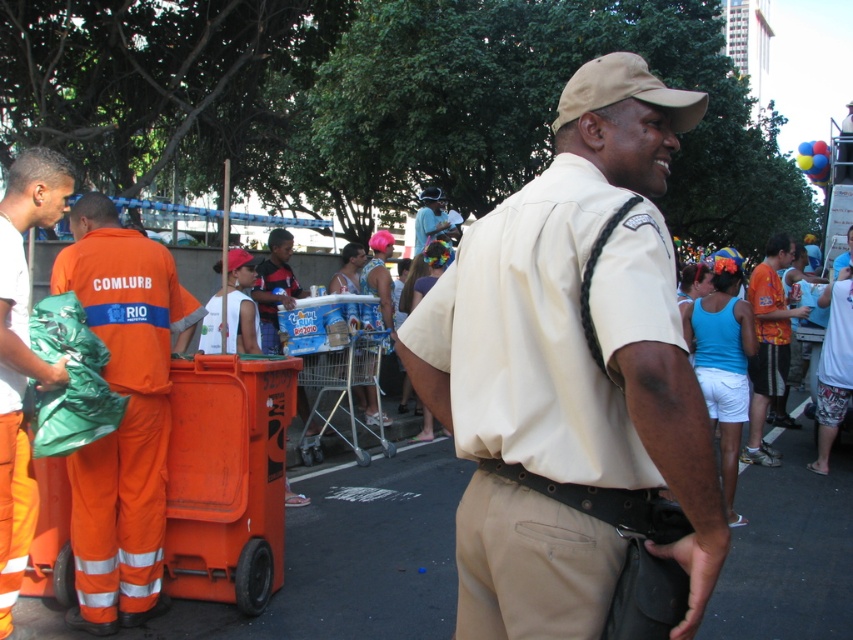
Question: Does beige uniform at center have a smaller size compared to white matte shirt at left?

Choices:
 (A) yes
 (B) no

Answer: (A)

Question: Which of the following is the farthest from the observer?

Choices:
 (A) orange jersey at center
 (B) matte blue helmet at center
 (C) orange reflective jumpsuit at left

Answer: (B)

Question: Does orange jersey at center have a smaller size compared to matte blue helmet at center?

Choices:
 (A) no
 (B) yes

Answer: (B)

Question: Which point is closer to the camera?

Choices:
 (A) (144, 336)
 (B) (68, 170)
 (C) (782, 385)

Answer: (B)

Question: Can you confirm if orange reflective jumpsuit at left is smaller than orange jersey at center?

Choices:
 (A) yes
 (B) no

Answer: (B)

Question: Which of the following is the closest to the observer?

Choices:
 (A) (689, 618)
 (B) (440, 211)
 (C) (3, 387)

Answer: (A)